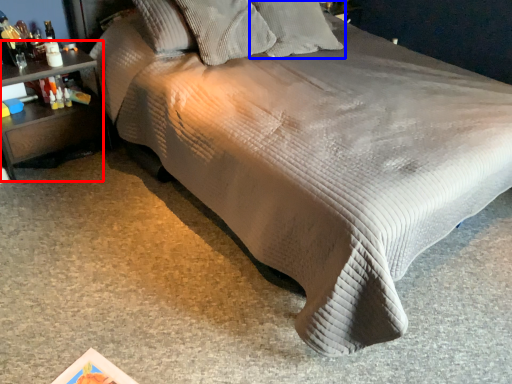
Question: Which point is further to the camera, nightstand (highlighted by a red box) or pillow (highlighted by a blue box)?

Choices:
 (A) nightstand
 (B) pillow

Answer: (B)